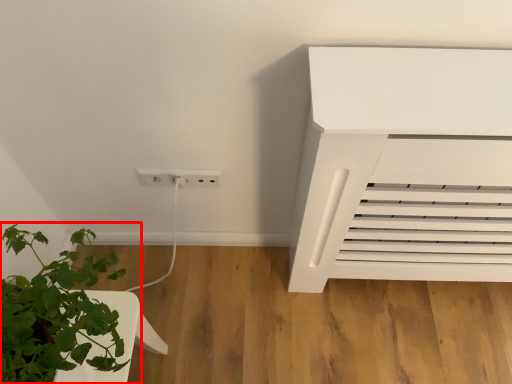
Question: From the image's perspective, where is houseplant (annotated by the red box) located in relation to electric outlet in the image?

Choices:
 (A) below
 (B) above

Answer: (A)